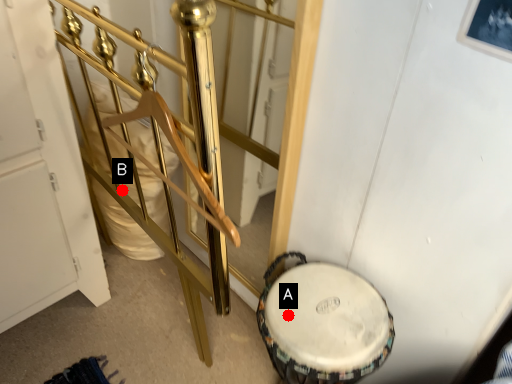
Question: Two points are circled on the image, labeled by A and B beside each circle. Which point is closer to the camera?

Choices:
 (A) A is closer
 (B) B is closer

Answer: (A)